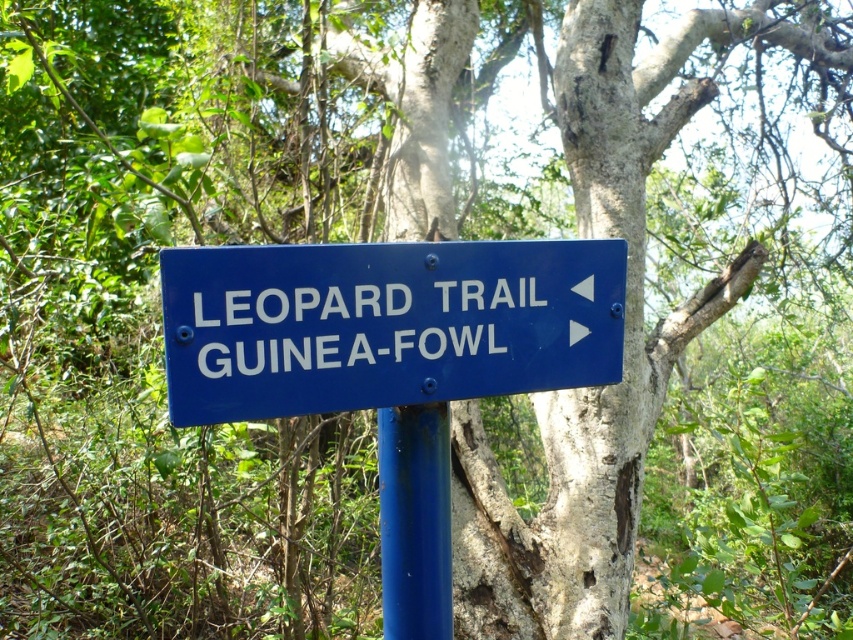
Is blue plastic sign at center above blue painted metal pole at center?

Indeed, blue plastic sign at center is positioned over blue painted metal pole at center.

Image resolution: width=853 pixels, height=640 pixels. I want to click on blue plastic sign at center, so click(386, 323).

This screenshot has height=640, width=853. Describe the element at coordinates (386, 323) in the screenshot. I see `blue plastic sign at center` at that location.

The image size is (853, 640). Find the location of `blue plastic sign at center`. blue plastic sign at center is located at coordinates (386, 323).